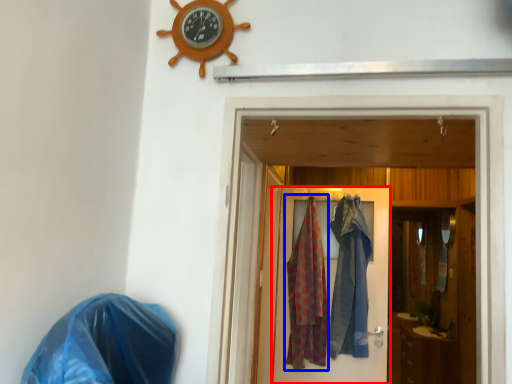
Question: Among these objects, which one is nearest to the camera, door (highlighted by a red box) or clothing (highlighted by a blue box)?

Choices:
 (A) door
 (B) clothing

Answer: (A)